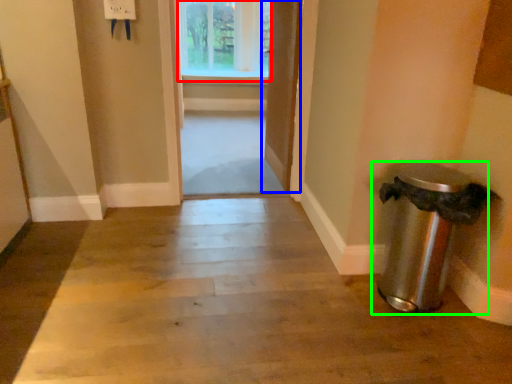
Question: Which object is the farthest from window (highlighted by a red box)? Choose among these: door (highlighted by a blue box) or waste container (highlighted by a green box).

Choices:
 (A) door
 (B) waste container

Answer: (B)